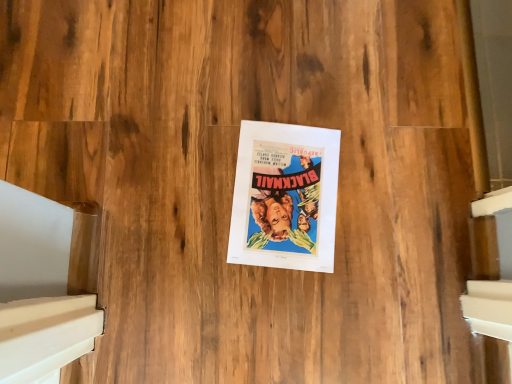
You are a GUI agent. You are given a task and a screenshot of the screen. Output one action in this format:
    pyautogui.click(x=<x>, y=<y>)
    Task: Click on the vacant area that is in front of matte paper poster at center
    Image resolution: width=512 pixels, height=384 pixels.
    Given the screenshot: What is the action you would take?
    (x=218, y=274)